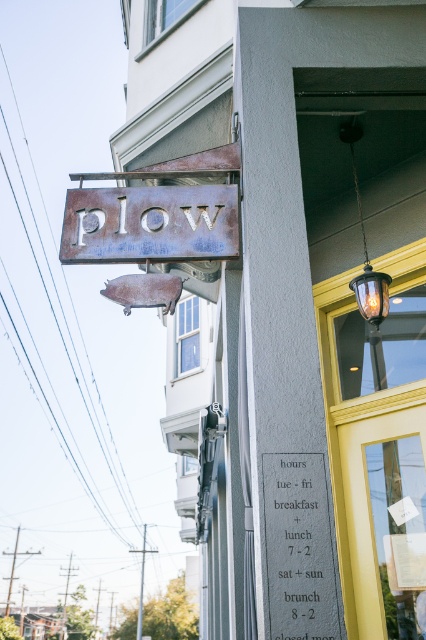
Is rusty metal sign at upper center above black metal sign at center?

Yes, rusty metal sign at upper center is above black metal sign at center.

Which is behind, point (184, 188) or point (282, 566)?

The point (184, 188) is behind.

This screenshot has height=640, width=426. Identify the location of rusty metal sign at upper center. (150, 225).

Is the position of rustic metal sign at upper center less distant than that of translucent glass lamp at upper center?

Yes, rustic metal sign at upper center is in front of translucent glass lamp at upper center.

Can you confirm if rustic metal sign at upper center is taller than translucent glass lamp at upper center?

Indeed, rustic metal sign at upper center has a greater height compared to translucent glass lamp at upper center.

Between point (371, 332) and point (367, 260), which one is positioned in front?

Point (367, 260) is more forward.

In order to click on rustic metal sign at upper center in this screenshot , I will do `click(339, 289)`.

Looking at this image, does rustic metal sign at upper center have a greater height compared to black metal sign at center?

Yes, rustic metal sign at upper center is taller than black metal sign at center.

The width and height of the screenshot is (426, 640). What do you see at coordinates (339, 289) in the screenshot?
I see `rustic metal sign at upper center` at bounding box center [339, 289].

What do you see at coordinates (339, 289) in the screenshot? I see `rustic metal sign at upper center` at bounding box center [339, 289].

Locate an element on the screen. This screenshot has width=426, height=640. rustic metal sign at upper center is located at coordinates (339, 289).